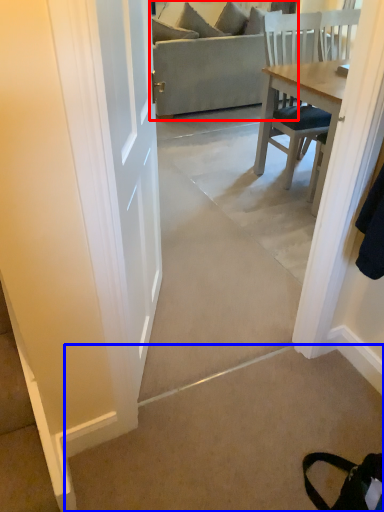
Question: Which point is closer to the camera, studio couch (highlighted by a red box) or concrete (highlighted by a blue box)?

Choices:
 (A) studio couch
 (B) concrete

Answer: (B)